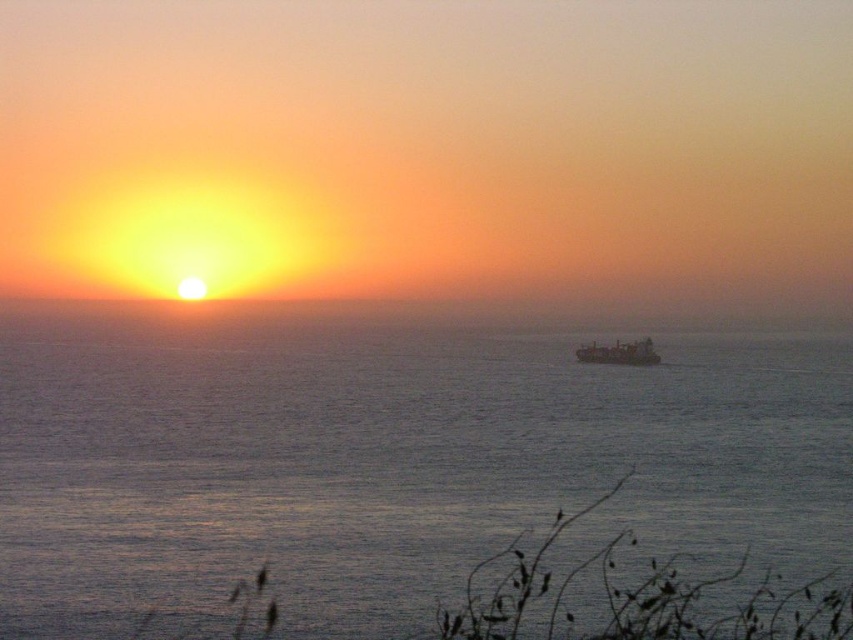
You are standing on the shore looking at the blue water at center and the metallic gray ship at center. Which object is closer to you?

The blue water at center is closer to you because it is in front of the metallic gray ship at center.

You are standing at the point closest to the horizon in the sunset scene. There are two points marked in the image, point A at coordinates point A is point [357,570] and point B at coordinates point B is point [582,349]. Which point is closer to your current position?

Point A at coordinates point A is point [357,570] is closer to your current position because it is in front of point B at coordinates point B is point [582,349], meaning it is nearer to the observer.

You are standing on the shore looking at the blue water at center and the metallic gray ship at center. Which object is closer to the horizon?

The metallic gray ship at center is closer to the horizon because it is above the blue water at center, which is positioned below it.